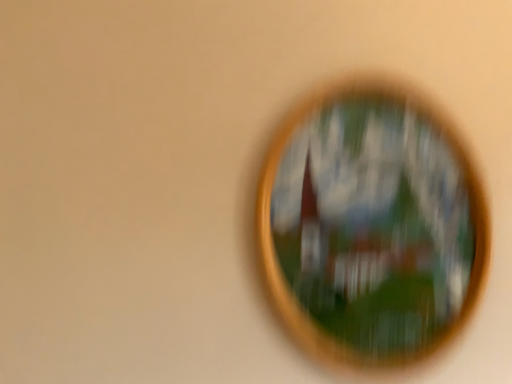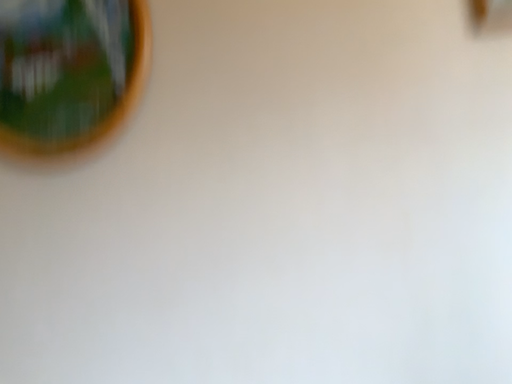
Question: How did the camera likely rotate when shooting the video?

Choices:
 (A) rotated downward
 (B) rotated upward

Answer: (A)